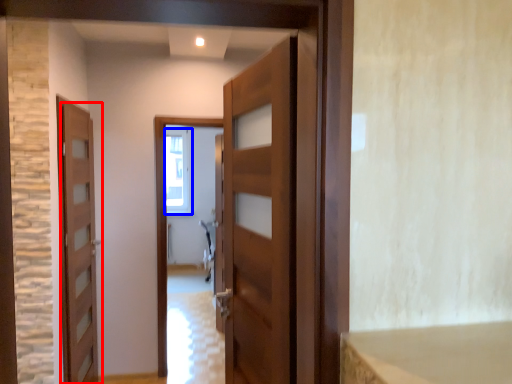
Question: Which object appears farthest to the camera in this image, door (highlighted by a red box) or window (highlighted by a blue box)?

Choices:
 (A) door
 (B) window

Answer: (B)